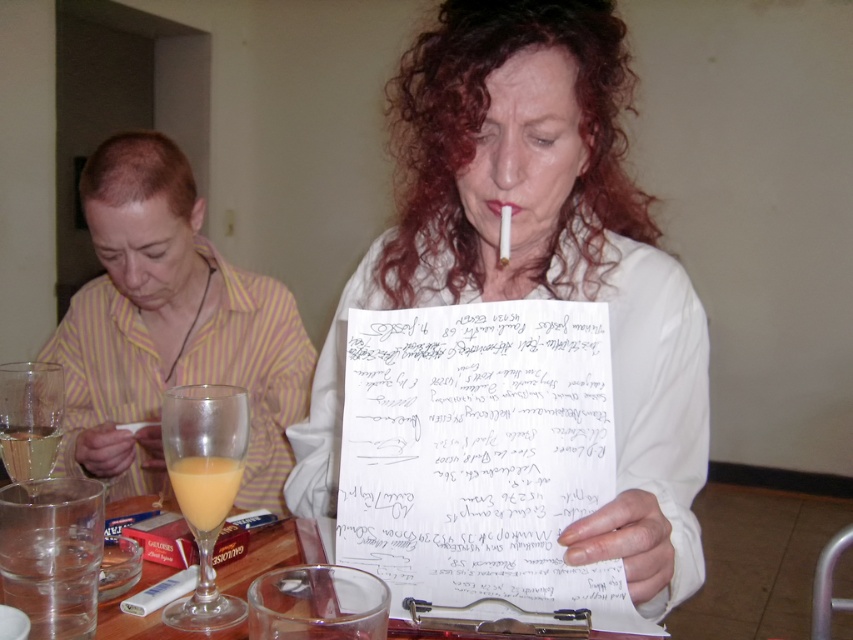
You are a guest at a dinner party and notice the white paper at center and the clear glass at center on the table. Which item would require more space to move around the table without touching the other items?

The white paper at center is bigger than the clear glass at center, so it would require more space to move around the table without touching the other items.